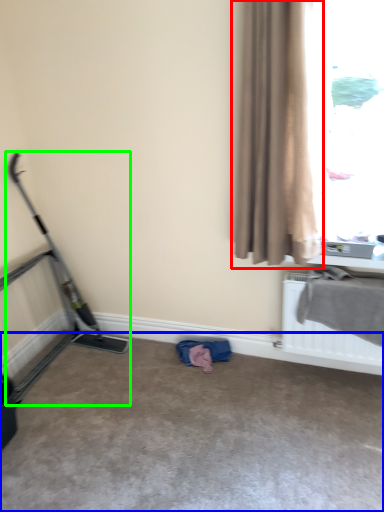
Question: Which object is positioned closest to curtain (highlighted by a red box)? Select from concrete (highlighted by a blue box) and baby carriage (highlighted by a green box).

Choices:
 (A) concrete
 (B) baby carriage

Answer: (A)